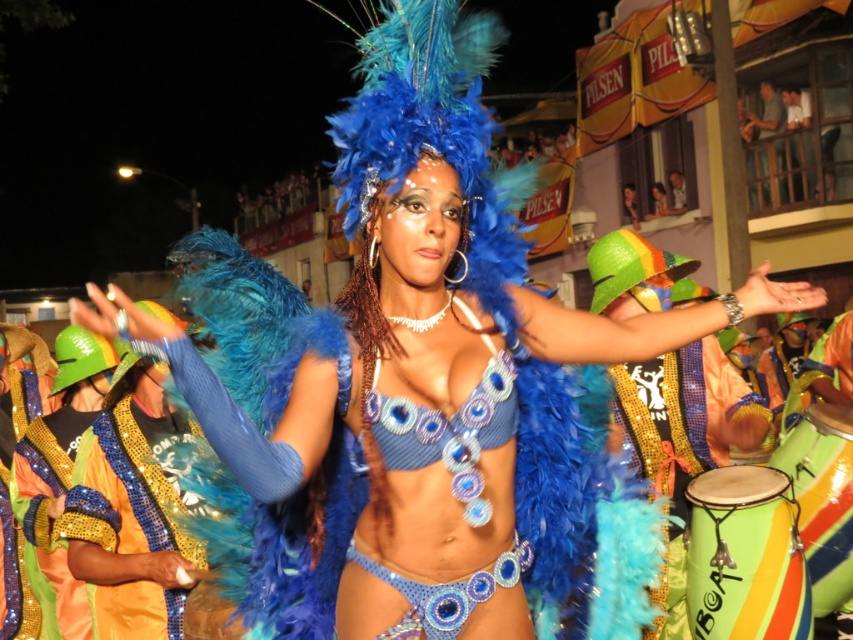
You are a photographer trying to capture the entire scene of the parade. You notice the shiny gold sequins at center and the green striped drum at lower right. Which object is shorter in height?

The shiny gold sequins at center has a lesser height compared to the green striped drum at lower right, so the shiny gold sequins at center is shorter in height.

You are a photographer at the event and want to capture both the shiny gold sequins at center and the green striped drum at lower right in a single shot. Which object should you focus on first to ensure both are in focus?

You should focus on the shiny gold sequins at center first since it is closer to the viewer than the green striped drum at lower right, allowing the drum to fall within the depth of field.

From the picture: You are a photographer at the parade and want to capture both the green painted wood drum at lower right and the green striped drum at lower right in a single shot. Which drum should you focus on first to ensure both are in frame?

The green painted wood drum at lower right is located below the green striped drum at lower right, so focusing on the higher positioned green striped drum at lower right first will allow you to frame both drums in the shot.